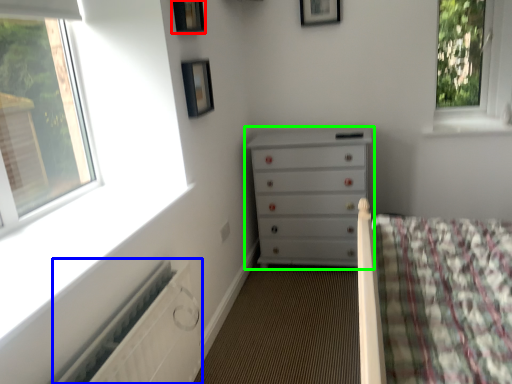
Question: Based on their relative distances, which object is farther from picture frame (highlighted by a red box)? Choose from radiator (highlighted by a blue box) and chest of drawers (highlighted by a green box).

Choices:
 (A) radiator
 (B) chest of drawers

Answer: (A)